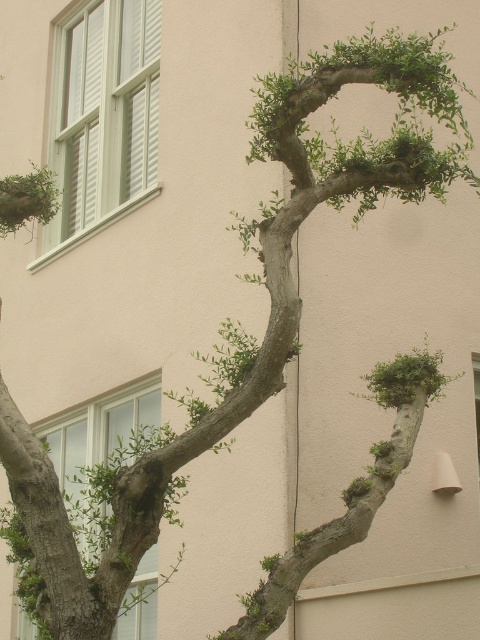
Between green leafy branch at center-right and green leafy branch at upper left, which one appears on the left side from the viewer's perspective?

Positioned to the left is green leafy branch at upper left.

Is point (397, 376) positioned in front of point (16, 209)?

No.

Which is behind, point (417, 396) or point (12, 225)?

Positioned behind is point (417, 396).

The width and height of the screenshot is (480, 640). Identify the location of green leafy branch at center-right. (408, 380).